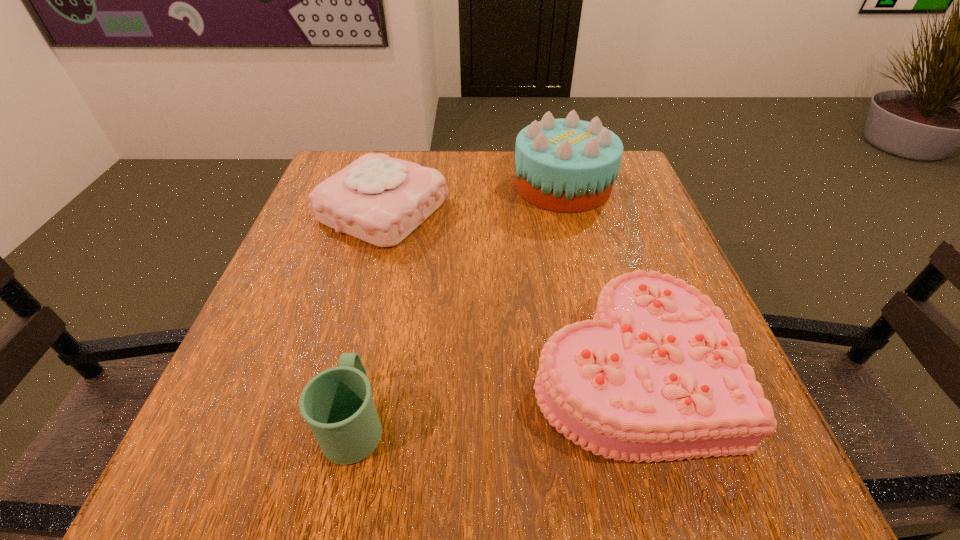
This screenshot has width=960, height=540. In order to click on vacant region between the shortest object and the tallest object in this screenshot , I will do `click(595, 276)`.

You are a GUI agent. You are given a task and a screenshot of the screen. Output one action in this format:
    pyautogui.click(x=<x>, y=<y>)
    Task: Click on the free space between the shortest object and the mug
    Image resolution: width=960 pixels, height=540 pixels.
    Given the screenshot: What is the action you would take?
    pyautogui.click(x=491, y=395)

I want to click on object that ranks as the third closest to the tallest object, so coord(337,403).

Locate which object ranks in proximity to the mug. Please provide its 2D coordinates. Your answer should be formatted as a tuple, i.e. [(x, y)], where the tuple contains the x and y coordinates of a point satisfying the conditions above.

[(658, 374)]

The width and height of the screenshot is (960, 540). In order to click on cake that can be found as the second closest to the tallest cake in this screenshot , I will do pyautogui.click(x=658, y=374).

Where is `cake that is the nearest to the tallest object`? cake that is the nearest to the tallest object is located at coordinates (378, 199).

Where is `vacant position in the image that satisfies the following two spatial constraints: 1. on the side of the shortest object with the handle; 2. on the right side of the mug`? vacant position in the image that satisfies the following two spatial constraints: 1. on the side of the shortest object with the handle; 2. on the right side of the mug is located at coordinates (367, 368).

Find the location of a particular element. This screenshot has width=960, height=540. vacant space that satisfies the following two spatial constraints: 1. on the back side of the leftmost cake; 2. on the left side of the tallest object is located at coordinates (390, 186).

In order to click on blank area in the image that satisfies the following two spatial constraints: 1. on the side of the mug with the handle; 2. on the right side of the tallest object in this screenshot , I will do `click(407, 186)`.

Image resolution: width=960 pixels, height=540 pixels. What are the coordinates of `vacant space that satisfies the following two spatial constraints: 1. on the side of the tallest cake with the handle; 2. on the right side of the mug` in the screenshot? It's located at (407, 186).